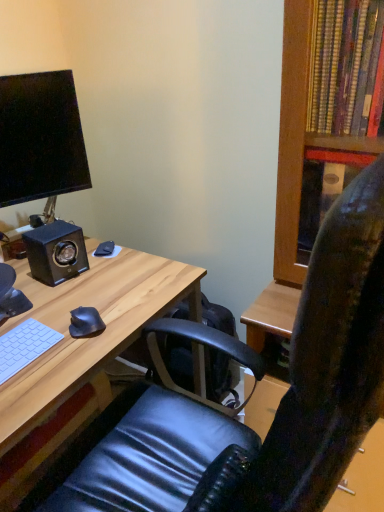
The width and height of the screenshot is (384, 512). I want to click on free space between white matte keyboard at lower left and black matte mouse at lower left, the second mouse when ordered from bottom to top, so click(62, 297).